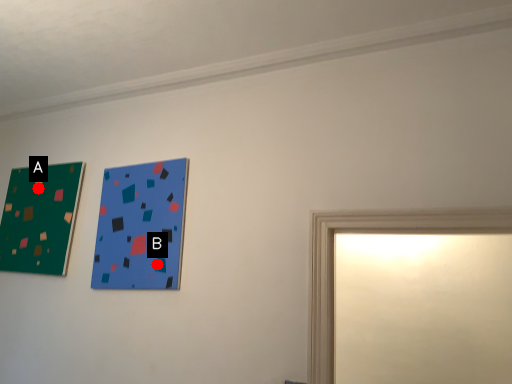
Question: Two points are circled on the image, labeled by A and B beside each circle. Which of the following is the closest to the observer?

Choices:
 (A) A is closer
 (B) B is closer

Answer: (B)